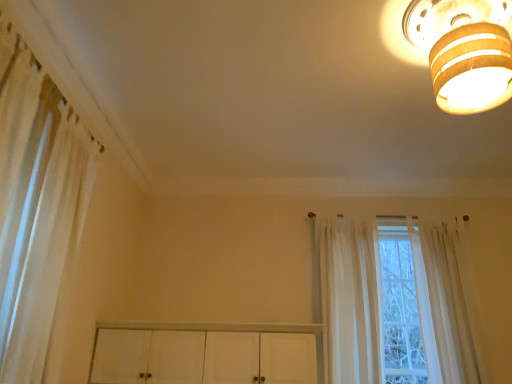
Question: Is white sheer curtain at left, marked as the third curtain in a right-to-left arrangement, not inside wooden ceiling light at upper right?

Choices:
 (A) yes
 (B) no

Answer: (A)

Question: Considering the relative positions of white sheer curtain at left, placed as the 1th curtain when sorted from left to right, and wooden ceiling light at upper right in the image provided, is white sheer curtain at left, placed as the 1th curtain when sorted from left to right, in front of wooden ceiling light at upper right?

Choices:
 (A) yes
 (B) no

Answer: (A)

Question: Is white sheer curtain at left, marked as the third curtain in a right-to-left arrangement, aimed at wooden ceiling light at upper right?

Choices:
 (A) yes
 (B) no

Answer: (A)

Question: Considering the relative sizes of white sheer curtain at left, marked as the third curtain in a right-to-left arrangement, and wooden ceiling light at upper right in the image provided, is white sheer curtain at left, marked as the third curtain in a right-to-left arrangement, thinner than wooden ceiling light at upper right?

Choices:
 (A) no
 (B) yes

Answer: (B)

Question: Does white sheer curtain at left, placed as the 1th curtain when sorted from left to right, appear on the left side of wooden ceiling light at upper right?

Choices:
 (A) no
 (B) yes

Answer: (B)

Question: Can you confirm if white sheer curtain at left, placed as the 1th curtain when sorted from left to right, is shorter than wooden ceiling light at upper right?

Choices:
 (A) yes
 (B) no

Answer: (B)

Question: Can you see sheer white curtain at right, which appears as the 3th curtain when viewed from the left, touching sheer white curtain at center, positioned as the 2th curtain in left-to-right order?

Choices:
 (A) no
 (B) yes

Answer: (A)

Question: Does sheer white curtain at right, which appears as the 3th curtain when viewed from the left, have a greater width compared to sheer white curtain at center, positioned as the 2th curtain in left-to-right order?

Choices:
 (A) yes
 (B) no

Answer: (A)

Question: Is sheer white curtain at right, which appears as the 3th curtain when viewed from the left, looking in the opposite direction of sheer white curtain at center, positioned as the 2th curtain in left-to-right order?

Choices:
 (A) yes
 (B) no

Answer: (B)

Question: Is sheer white curtain at right, the 1th curtain from the right, thinner than sheer white curtain at center, positioned as the 2th curtain in left-to-right order?

Choices:
 (A) no
 (B) yes

Answer: (A)

Question: Considering the relative sizes of sheer white curtain at right, the 1th curtain from the right, and sheer white curtain at center, which appears as the 2th curtain when viewed from the right, in the image provided, is sheer white curtain at right, the 1th curtain from the right, shorter than sheer white curtain at center, which appears as the 2th curtain when viewed from the right,?

Choices:
 (A) no
 (B) yes

Answer: (B)

Question: From a real-world perspective, is sheer white curtain at right, the 1th curtain from the right, located beneath sheer white curtain at center, positioned as the 2th curtain in left-to-right order?

Choices:
 (A) yes
 (B) no

Answer: (B)

Question: Is wooden ceiling light at upper right wider than sheer white curtain at center, positioned as the 2th curtain in left-to-right order?

Choices:
 (A) no
 (B) yes

Answer: (B)